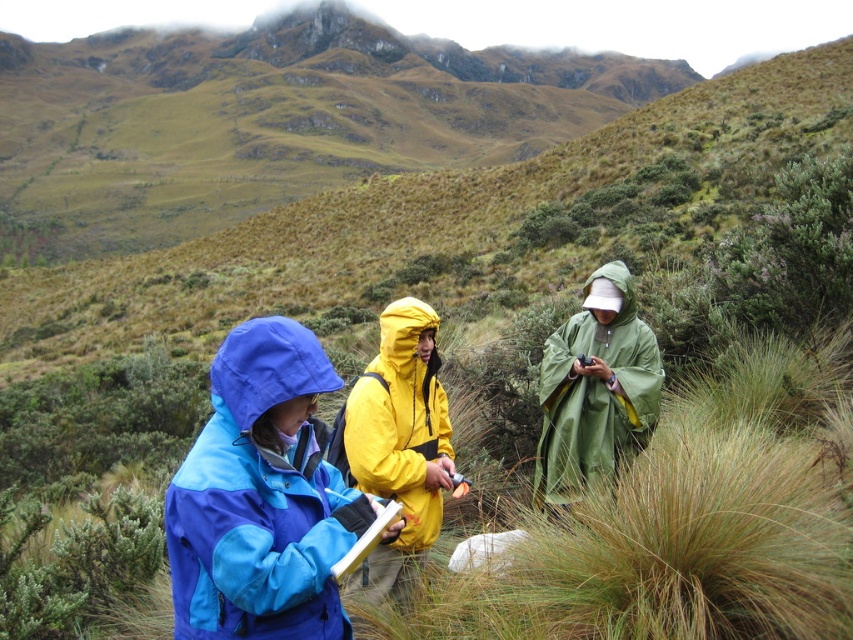
You are standing in the mountainous grassy landscape and want to walk from point A to point B. Point A is at coordinate point (579, 529) and point B is at coordinate point (305, 404). Which direction should you move to get closer to point B?

To move from point A at coordinate point (579, 529) to point B at coordinate point (305, 404), you should move towards the lower left direction since point B is located at a lower coordinate in both the x and y axes compared to point A.

You are planning to buy a waterproof jacket for a hiking trip. You see two options in the image, the blue waterproof jacket at left and the green waterproof poncho at center. Which one is smaller in size?

The blue waterproof jacket at left is smaller in size compared to the green waterproof poncho at center.